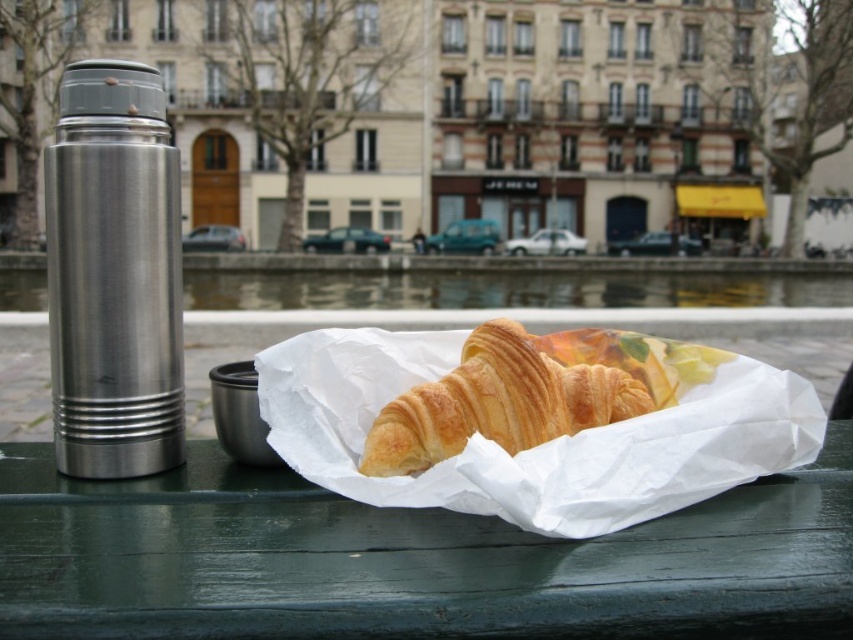
You are a tourist sitting at the green painted wood table at center and want to reach for the golden brown croissant at center. Which direction should you move your hand to grab it?

The green painted wood table at center is to the left of golden brown croissant at center, so you should move your hand to the right to grab it.

You are standing in the outdoor scene and want to walk from point (9, 449) to point (601, 378). Which direction should you face to move towards your destination?

To move from point (9, 449) to point (601, 378), you should face north because point (601, 378) is located north of point (9, 449).